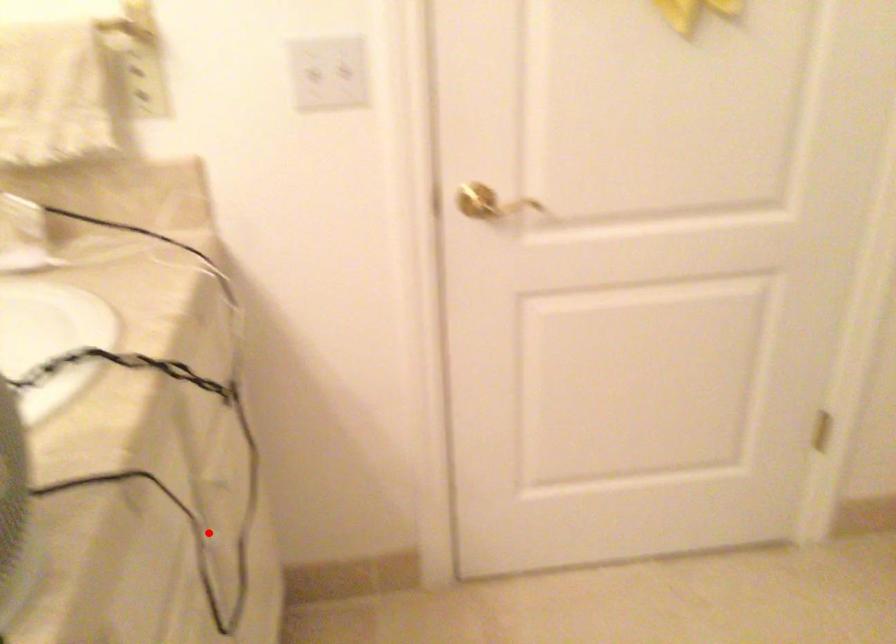
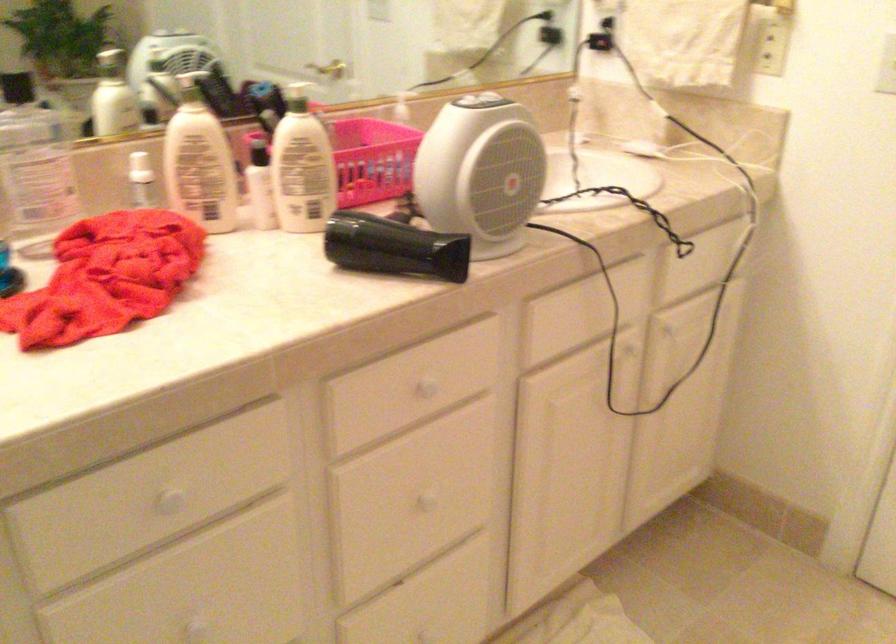
Question: I am providing you with two images of the same scene from different viewpoints. A red point is shown in image1. For the corresponding object point in image2, is it positioned nearer or farther from the camera?

Choices:
 (A) Nearer
 (B) Farther

Answer: (B)